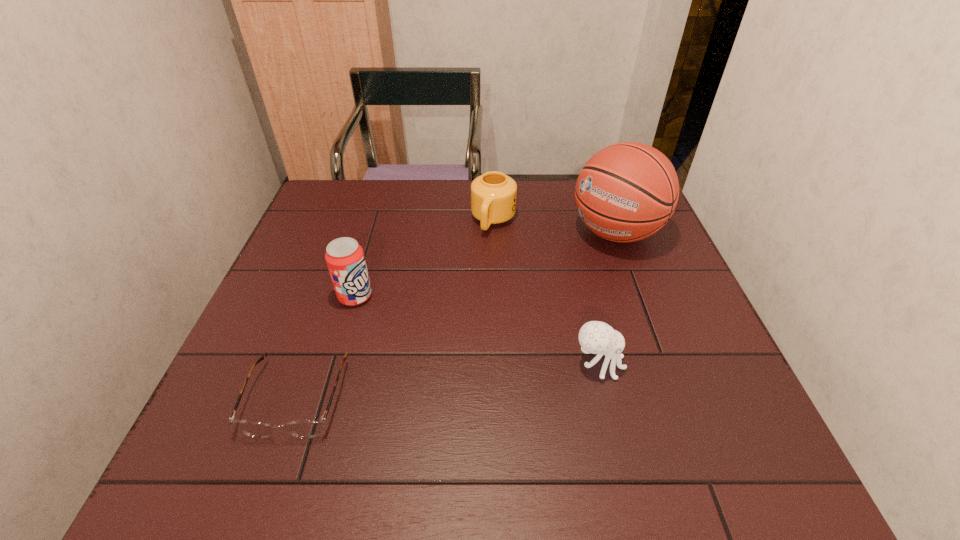
Find the location of `object present at the right edge`. object present at the right edge is located at coordinates (626, 192).

This screenshot has height=540, width=960. In order to click on object present at the near left corner in this screenshot , I will do point(308,428).

At what (x,y) coordinates should I click in order to perform the action: click on object that is at the far right corner. Please return your answer as a coordinate pair (x, y). Image resolution: width=960 pixels, height=540 pixels. Looking at the image, I should click on (626, 192).

The width and height of the screenshot is (960, 540). Identify the location of vacant space at the far edge. (435, 206).

In order to click on vacant region at the left edge of the desktop in this screenshot , I will do `click(302, 281)`.

The image size is (960, 540). In the image, there is a desktop. Identify the location of free region at the right edge. (613, 253).

Locate an element on the screen. The height and width of the screenshot is (540, 960). vacant space at the far left corner is located at coordinates (317, 220).

In the image, there is a desktop. Identify the location of free space at the near left corner. This screenshot has height=540, width=960. (269, 420).

What are the coordinates of `vacant space in between the tallest object and the octopus` in the screenshot? It's located at (607, 298).

Identify the location of vacant region between the third object from left to right and the tallest object. The height and width of the screenshot is (540, 960). (554, 226).